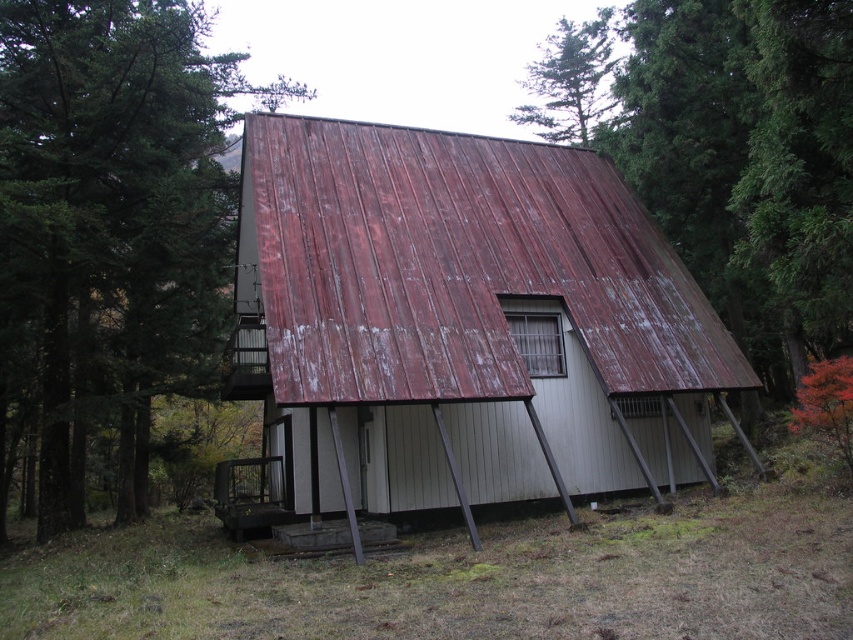
Can you confirm if green leafy tree at left is positioned to the left of green textured tree at upper center?

Yes, green leafy tree at left is to the left of green textured tree at upper center.

Measure the distance between point (79, 358) and camera.

Point (79, 358) and camera are 17.94 meters apart.

Which is behind, point (99, 19) or point (769, 381)?

Positioned behind is point (769, 381).

The height and width of the screenshot is (640, 853). Find the location of `green leafy tree at left`. green leafy tree at left is located at coordinates (109, 220).

Is rusty metal barn at center above green leafy tree at left?

Incorrect, rusty metal barn at center is not positioned above green leafy tree at left.

Does rusty metal barn at center have a greater width compared to green leafy tree at left?

Yes, rusty metal barn at center is wider than green leafy tree at left.

Who is more forward, (321, 272) or (212, 204)?

Point (321, 272) is more forward.

The height and width of the screenshot is (640, 853). In order to click on rusty metal barn at center in this screenshot , I will do `click(463, 323)`.

Does rusty metal barn at center have a lesser height compared to green textured tree at upper center?

Yes.

Is rusty metal barn at center smaller than green textured tree at upper center?

Indeed, rusty metal barn at center has a smaller size compared to green textured tree at upper center.

Where is `rusty metal barn at center`? rusty metal barn at center is located at coordinates (463, 323).

Where is `rusty metal barn at center`? The width and height of the screenshot is (853, 640). rusty metal barn at center is located at coordinates (463, 323).